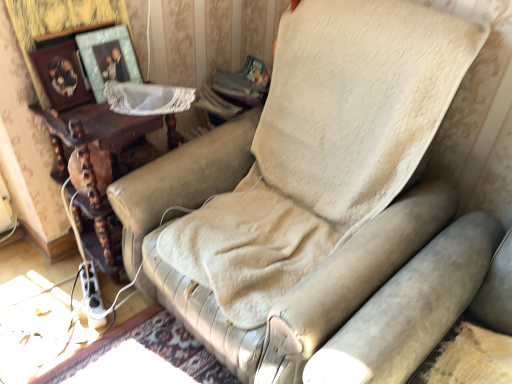
This screenshot has height=384, width=512. What do you see at coordinates (94, 128) in the screenshot?
I see `brown wooden table at left` at bounding box center [94, 128].

What are the coordinates of `wooden photo frame at upper left, which is the first picture frame in left-to-right order` in the screenshot? It's located at (61, 75).

Is brown wooden table at left behind metallic silver picture frame at upper left, which appears as the second picture frame when viewed from the left?

No, it is not.

You are a GUI agent. You are given a task and a screenshot of the screen. Output one action in this format:
    pyautogui.click(x=<x>, y=<y>)
    Task: Click on the furniture below the metallic silver picture frame at upper left, which ranks as the 1th picture frame in right-to-left order (from the image's perspective)
    This screenshot has width=512, height=384.
    Given the screenshot: What is the action you would take?
    pyautogui.click(x=94, y=128)

How far apart are brown wooden table at left and metallic silver picture frame at upper left, which ranks as the 1th picture frame in right-to-left order?

brown wooden table at left and metallic silver picture frame at upper left, which ranks as the 1th picture frame in right-to-left order, are 6.39 inches apart from each other.

Is brown wooden table at left at the right side of metallic silver picture frame at upper left, which ranks as the 1th picture frame in right-to-left order?

In fact, brown wooden table at left is to the left of metallic silver picture frame at upper left, which ranks as the 1th picture frame in right-to-left order.

Where is `furniture below the metallic silver picture frame at upper left, which ranks as the 1th picture frame in right-to-left order (from a real-world perspective)`? This screenshot has height=384, width=512. furniture below the metallic silver picture frame at upper left, which ranks as the 1th picture frame in right-to-left order (from a real-world perspective) is located at coordinates (94, 128).

From the image's perspective, does metallic silver picture frame at upper left, which appears as the second picture frame when viewed from the left, appear higher than brown wooden table at left?

Correct, metallic silver picture frame at upper left, which appears as the second picture frame when viewed from the left, appears higher than brown wooden table at left in the image.

Is metallic silver picture frame at upper left, which appears as the second picture frame when viewed from the left, completely or partially outside of brown wooden table at left?

metallic silver picture frame at upper left, which appears as the second picture frame when viewed from the left, is positioned outside brown wooden table at left.

Who is shorter, metallic silver picture frame at upper left, which appears as the second picture frame when viewed from the left, or wooden photo frame at upper left, which appears as the second picture frame when viewed from the right?

With less height is wooden photo frame at upper left, which appears as the second picture frame when viewed from the right.

This screenshot has height=384, width=512. Find the location of `picture frame located behind the wooden photo frame at upper left, which is the first picture frame in left-to-right order`. picture frame located behind the wooden photo frame at upper left, which is the first picture frame in left-to-right order is located at coordinates (108, 58).

Looking at this image, from a real-world perspective, is metallic silver picture frame at upper left, which appears as the second picture frame when viewed from the left, over wooden photo frame at upper left, which appears as the second picture frame when viewed from the right?

Incorrect, from a real-world perspective, metallic silver picture frame at upper left, which appears as the second picture frame when viewed from the left, is lower than wooden photo frame at upper left, which appears as the second picture frame when viewed from the right.

Is metallic silver picture frame at upper left, which appears as the second picture frame when viewed from the left, oriented towards wooden photo frame at upper left, which appears as the second picture frame when viewed from the right?

No, metallic silver picture frame at upper left, which appears as the second picture frame when viewed from the left, is not facing towards wooden photo frame at upper left, which appears as the second picture frame when viewed from the right.

Who is taller, brown wooden table at left or wooden photo frame at upper left, which is the first picture frame in left-to-right order?

Standing taller between the two is brown wooden table at left.

Would you say brown wooden table at left is a long distance from wooden photo frame at upper left, which is the first picture frame in left-to-right order?

brown wooden table at left is actually quite close to wooden photo frame at upper left, which is the first picture frame in left-to-right order.

Does brown wooden table at left have a larger size compared to wooden photo frame at upper left, which is the first picture frame in left-to-right order?

Yes.

Is there a large distance between wooden photo frame at upper left, which appears as the second picture frame when viewed from the right, and brown wooden table at left?

They are positioned close to each other.

How different are the orientations of wooden photo frame at upper left, which appears as the second picture frame when viewed from the right, and brown wooden table at left in degrees?

The facing directions of wooden photo frame at upper left, which appears as the second picture frame when viewed from the right, and brown wooden table at left are 1.99 degrees apart.

Does wooden photo frame at upper left, which appears as the second picture frame when viewed from the right, have a larger size compared to brown wooden table at left?

Actually, wooden photo frame at upper left, which appears as the second picture frame when viewed from the right, might be smaller than brown wooden table at left.

Which is more to the right, wooden photo frame at upper left, which is the first picture frame in left-to-right order, or metallic silver picture frame at upper left, which appears as the second picture frame when viewed from the left?

From the viewer's perspective, metallic silver picture frame at upper left, which appears as the second picture frame when viewed from the left, appears more on the right side.

Based on the photo, is wooden photo frame at upper left, which is the first picture frame in left-to-right order, oriented away from metallic silver picture frame at upper left, which appears as the second picture frame when viewed from the left?

No, wooden photo frame at upper left, which is the first picture frame in left-to-right order, is not facing away from metallic silver picture frame at upper left, which appears as the second picture frame when viewed from the left.

Is point (73, 66) closer or farther from the camera than point (113, 62)?

Clearly, point (73, 66) is closer to the camera than point (113, 62).

From the picture: Is wooden photo frame at upper left, which is the first picture frame in left-to-right order, wider or thinner than metallic silver picture frame at upper left, which ranks as the 1th picture frame in right-to-left order?

In the image, wooden photo frame at upper left, which is the first picture frame in left-to-right order, appears to be wider than metallic silver picture frame at upper left, which ranks as the 1th picture frame in right-to-left order.

The width and height of the screenshot is (512, 384). Identify the location of picture frame behind the brown wooden table at left. (108, 58).

From the image's perspective, starting from the brown wooden table at left, which picture frame is the 2nd one above? Please provide its 2D coordinates.

[(108, 58)]

From the image, which object appears to be nearer to metallic silver picture frame at upper left, which ranks as the 1th picture frame in right-to-left order, wooden photo frame at upper left, which appears as the second picture frame when viewed from the right, or brown wooden table at left?

Among the two, wooden photo frame at upper left, which appears as the second picture frame when viewed from the right, is located nearer to metallic silver picture frame at upper left, which ranks as the 1th picture frame in right-to-left order.

Which object lies further to the anchor point brown wooden table at left, metallic silver picture frame at upper left, which ranks as the 1th picture frame in right-to-left order, or wooden photo frame at upper left, which is the first picture frame in left-to-right order?

The object further to brown wooden table at left is metallic silver picture frame at upper left, which ranks as the 1th picture frame in right-to-left order.

When comparing their distances from metallic silver picture frame at upper left, which appears as the second picture frame when viewed from the left, does brown wooden table at left or wooden photo frame at upper left, which appears as the second picture frame when viewed from the right, seem closer?

wooden photo frame at upper left, which appears as the second picture frame when viewed from the right.

From the image, which object appears to be farther from brown wooden table at left, wooden photo frame at upper left, which is the first picture frame in left-to-right order, or metallic silver picture frame at upper left, which ranks as the 1th picture frame in right-to-left order?

metallic silver picture frame at upper left, which ranks as the 1th picture frame in right-to-left order, is positioned further to the anchor brown wooden table at left.

Based on their spatial positions, is metallic silver picture frame at upper left, which appears as the second picture frame when viewed from the left, or brown wooden table at left closer to wooden photo frame at upper left, which appears as the second picture frame when viewed from the right?

metallic silver picture frame at upper left, which appears as the second picture frame when viewed from the left.

Looking at the image, which one is located closer to wooden photo frame at upper left, which appears as the second picture frame when viewed from the right, brown wooden table at left or metallic silver picture frame at upper left, which ranks as the 1th picture frame in right-to-left order?

metallic silver picture frame at upper left, which ranks as the 1th picture frame in right-to-left order, is closer to wooden photo frame at upper left, which appears as the second picture frame when viewed from the right.

I want to click on picture frame between metallic silver picture frame at upper left, which appears as the second picture frame when viewed from the left, and brown wooden table at left, in the vertical direction, so click(x=61, y=75).